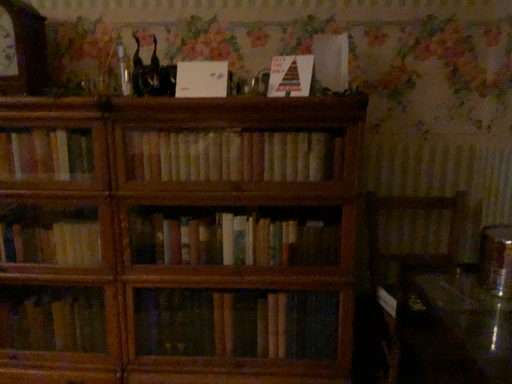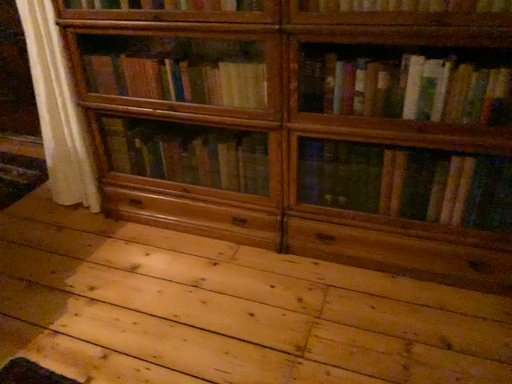
Question: Which way did the camera rotate in the video?

Choices:
 (A) rotated downward
 (B) rotated upward

Answer: (A)